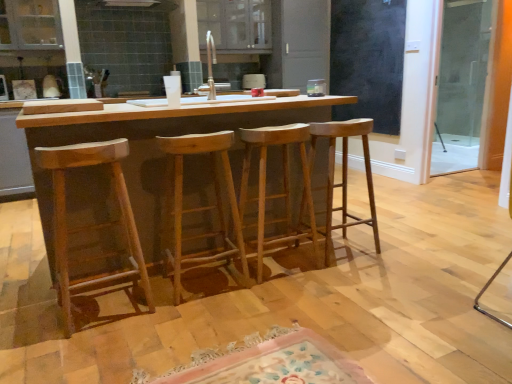
Identify the location of vacant space underneath natural wood stool at center, arranged as the third stool when viewed from the left (from a real-world perspective). The image size is (512, 384). (270, 262).